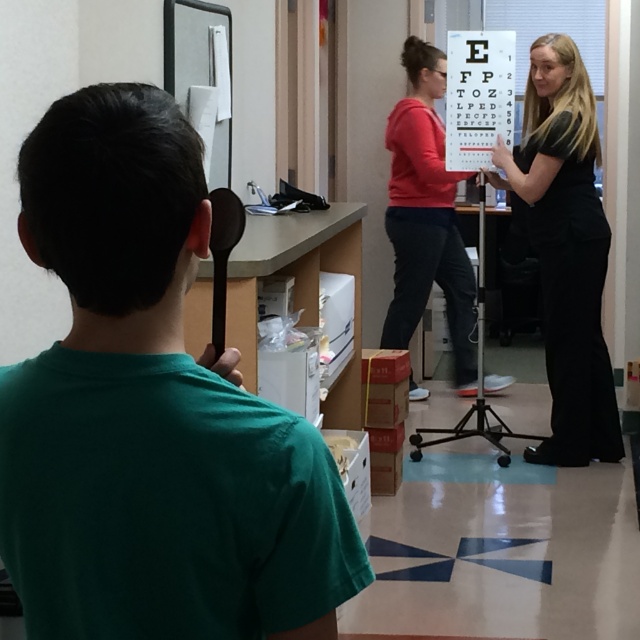
You are a patient in a vision testing room. You see the green matte shirt at center and the black smooth dress at right. Which clothing item is positioned lower in the image?

The green matte shirt at center is below the black smooth dress at right, so the green matte shirt at center is positioned lower in the image.

You are a patient in the vision testing room. You need to hand a note to the person wearing the black smooth dress at right. Which direction should you move to reach them from the person wearing the matte red shirt at center?

The black smooth dress at right is to the right of the matte red shirt at center, so you should move to your right to reach them.

You are a tailor measuring clothing for customers. You need to determine which garment requires more fabric between the green matte shirt at center and the black smooth dress at right. Based on the scene, which one would need more fabric?

The black smooth dress at right requires more fabric because its width is greater than the green matte shirt at center.